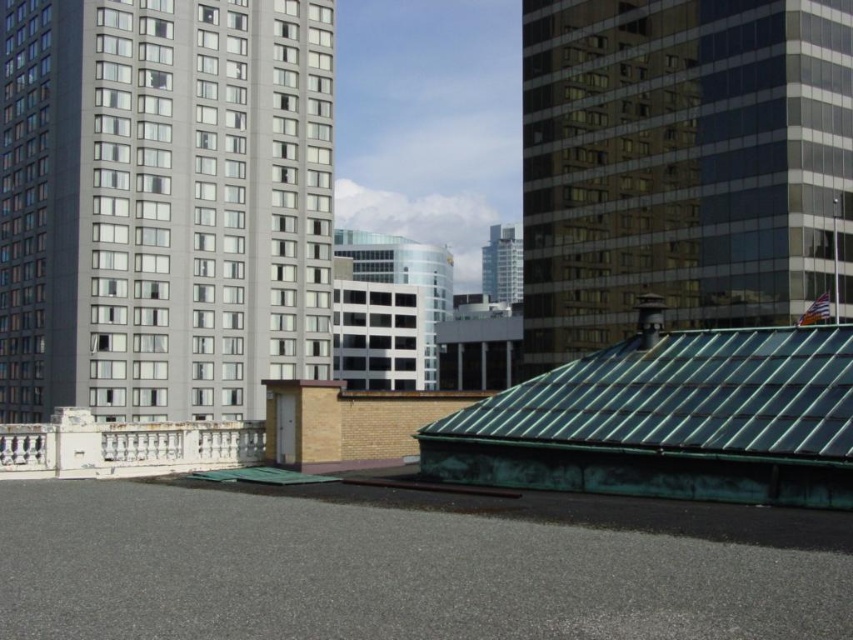
This screenshot has width=853, height=640. Describe the element at coordinates (682, 164) in the screenshot. I see `green glass roof at upper right` at that location.

Is point (550, 225) positioned before point (341, 257)?

Yes, it is.

The height and width of the screenshot is (640, 853). Find the location of `green glass roof at upper right`. green glass roof at upper right is located at coordinates (682, 164).

Can you confirm if gray concrete building at left is positioned to the right of green glass roof at upper right?

Incorrect, gray concrete building at left is not on the right side of green glass roof at upper right.

How much distance is there between gray concrete building at left and green glass roof at upper right?

gray concrete building at left and green glass roof at upper right are 39.81 meters apart.

Locate an element on the screen. gray concrete building at left is located at coordinates (163, 204).

Is gray concrete building at left behind matte glass skyscraper at center?

No.

Can you confirm if gray concrete building at left is bigger than matte glass skyscraper at center?

Yes, gray concrete building at left is bigger than matte glass skyscraper at center.

Is point (207, 116) closer to viewer compared to point (515, 289)?

Yes, it is.

Find the location of a particular element. gray concrete building at left is located at coordinates (163, 204).